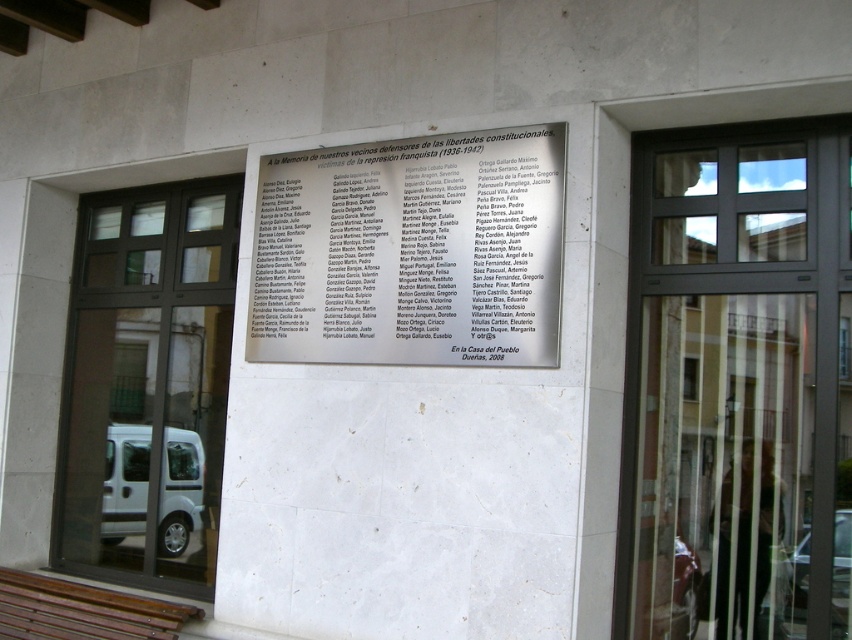
Is point (561, 248) less distant than point (145, 625)?

Yes, it is in front of point (145, 625).

Is white paper at center positioned before brown wooden bench at lower left?

Yes, white paper at center is closer to the viewer.

This screenshot has height=640, width=852. Find the location of `white paper at center`. white paper at center is located at coordinates (412, 252).

At what (x,y) coordinates should I click in order to perform the action: click on white paper at center. Please return your answer as a coordinate pair (x, y). The width and height of the screenshot is (852, 640). Looking at the image, I should click on (412, 252).

Is white paper at center below black glass door at center?

Incorrect, white paper at center is not positioned below black glass door at center.

Based on the photo, who is shorter, white paper at center or black glass door at center?

With less height is white paper at center.

Does point (484, 278) come farther from viewer compared to point (196, 333)?

No, (484, 278) is in front of (196, 333).

You are a GUI agent. You are given a task and a screenshot of the screen. Output one action in this format:
    pyautogui.click(x=<x>, y=<y>)
    Task: Click on the white paper at center
    This screenshot has height=640, width=852.
    Given the screenshot: What is the action you would take?
    pyautogui.click(x=412, y=252)

Measure the distance from metallic glass door at center to white paper at center.

metallic glass door at center is 1.11 meters from white paper at center.

What do you see at coordinates (737, 385) in the screenshot? I see `metallic glass door at center` at bounding box center [737, 385].

This screenshot has height=640, width=852. I want to click on metallic glass door at center, so click(x=737, y=385).